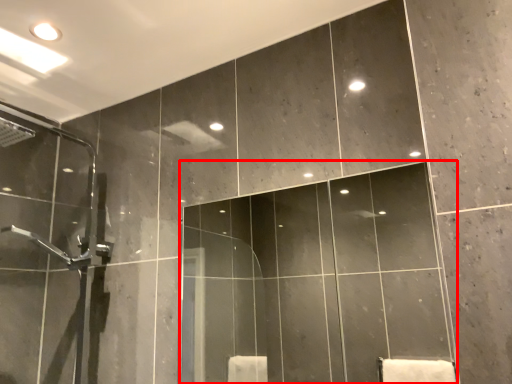
Question: Considering the relative positions of mirror (annotated by the red box) and screen door in the image provided, where is mirror (annotated by the red box) located with respect to the staircase?

Choices:
 (A) left
 (B) right

Answer: (B)